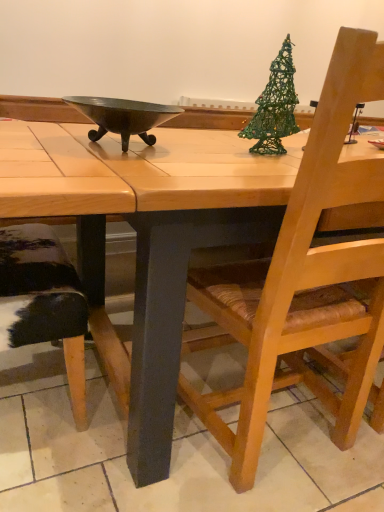
Where is `vacant space to the left of wooden chair with woven seat at right`? This screenshot has height=512, width=384. vacant space to the left of wooden chair with woven seat at right is located at coordinates (126, 459).